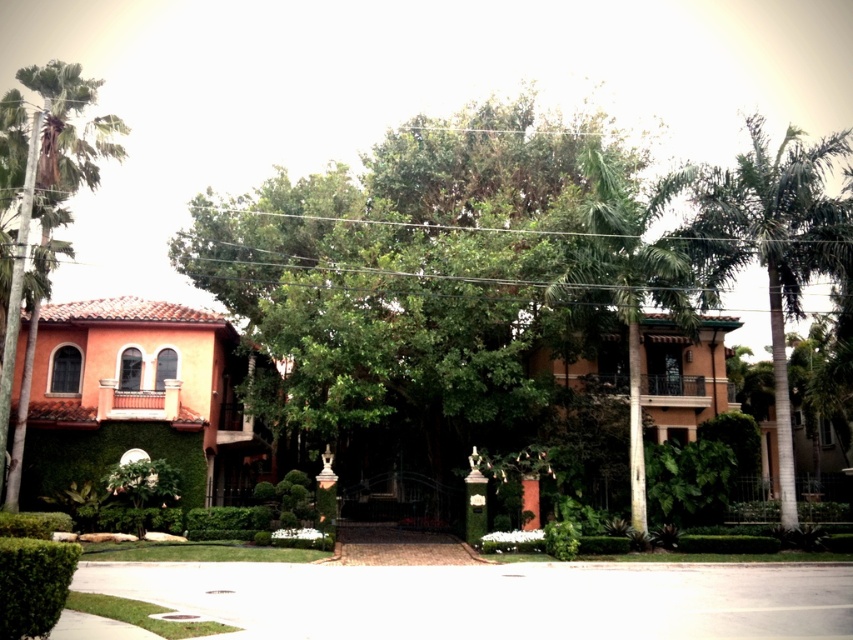
Does green leafy tree at center have a greater height compared to green leafy palm tree at right?

No.

Which is more to the left, green leafy tree at center or green leafy palm tree at right?

Positioned to the left is green leafy tree at center.

Is point (280, 180) closer to viewer compared to point (694, 220)?

No, (280, 180) is further to viewer.

Identify the location of green leafy tree at center. (460, 273).

Looking at this image, does green leafy palm tree at center have a larger size compared to green leafy palm tree at left?

No, green leafy palm tree at center is not bigger than green leafy palm tree at left.

Measure the distance between green leafy palm tree at center and green leafy palm tree at left.

green leafy palm tree at center and green leafy palm tree at left are 19.17 meters apart from each other.

Where is `green leafy palm tree at center`? The width and height of the screenshot is (853, 640). green leafy palm tree at center is located at coordinates (628, 276).

The height and width of the screenshot is (640, 853). What are the coordinates of `green leafy tree at center` in the screenshot? It's located at (460, 273).

Between green leafy tree at center and green leafy palm tree at left, which one has more height?

With more height is green leafy palm tree at left.

Does point (416, 340) come closer to viewer compared to point (108, 157)?

Yes, it is in front of point (108, 157).

This screenshot has width=853, height=640. Find the location of `green leafy tree at center`. green leafy tree at center is located at coordinates (460, 273).